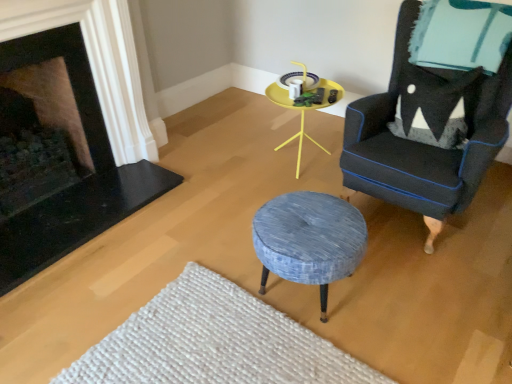
Question: Does white textured rug at lower center have a lesser height compared to textured blue fabric stool at center?

Choices:
 (A) no
 (B) yes

Answer: (B)

Question: Considering the relative sizes of white textured rug at lower center and textured blue fabric stool at center in the image provided, is white textured rug at lower center taller than textured blue fabric stool at center?

Choices:
 (A) no
 (B) yes

Answer: (A)

Question: From a real-world perspective, is white textured rug at lower center physically below textured blue fabric stool at center?

Choices:
 (A) no
 (B) yes

Answer: (B)

Question: From the image's perspective, is white textured rug at lower center under textured blue fabric stool at center?

Choices:
 (A) yes
 (B) no

Answer: (A)

Question: From the image's perspective, is white textured rug at lower center on textured blue fabric stool at center?

Choices:
 (A) no
 (B) yes

Answer: (A)

Question: Is white textured rug at lower center next to textured blue fabric stool at center and touching it?

Choices:
 (A) yes
 (B) no

Answer: (B)

Question: Can you confirm if textured blue fabric stool at center is positioned to the right of yellow plastic table at center?

Choices:
 (A) no
 (B) yes

Answer: (A)

Question: Is textured blue fabric stool at center directly adjacent to yellow plastic table at center?

Choices:
 (A) no
 (B) yes

Answer: (A)

Question: Is textured blue fabric stool at center outside of yellow plastic table at center?

Choices:
 (A) no
 (B) yes

Answer: (B)

Question: From a real-world perspective, is textured blue fabric stool at center physically above yellow plastic table at center?

Choices:
 (A) no
 (B) yes

Answer: (A)

Question: Can you confirm if textured blue fabric stool at center is positioned to the left of yellow plastic table at center?

Choices:
 (A) no
 (B) yes

Answer: (B)

Question: From the image's perspective, is textured blue fabric stool at center under yellow plastic table at center?

Choices:
 (A) yes
 (B) no

Answer: (A)

Question: Can you confirm if yellow plastic table at center is thinner than black stone fireplace at left, which is the 2th fireplace from left to right?

Choices:
 (A) no
 (B) yes

Answer: (A)